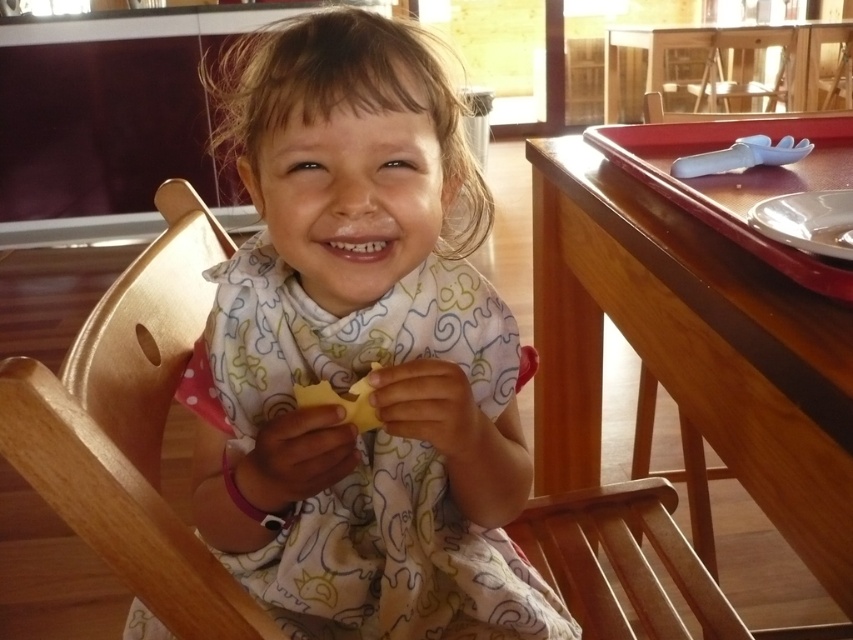
You are a parent trying to place a snack for your child. You have the yellow rubbery cheese at center. Where should you place it so that it is to the right of the wooden highchair at center?

You should place the yellow rubbery cheese at center to the right side of the wooden highchair at center since the wooden highchair at center is positioned on the left side of yellow rubbery cheese at center.